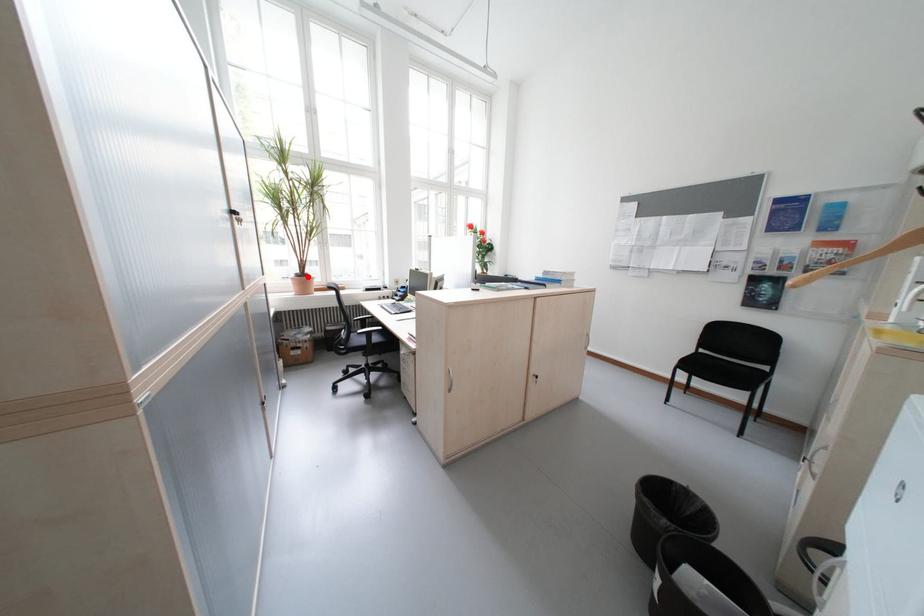
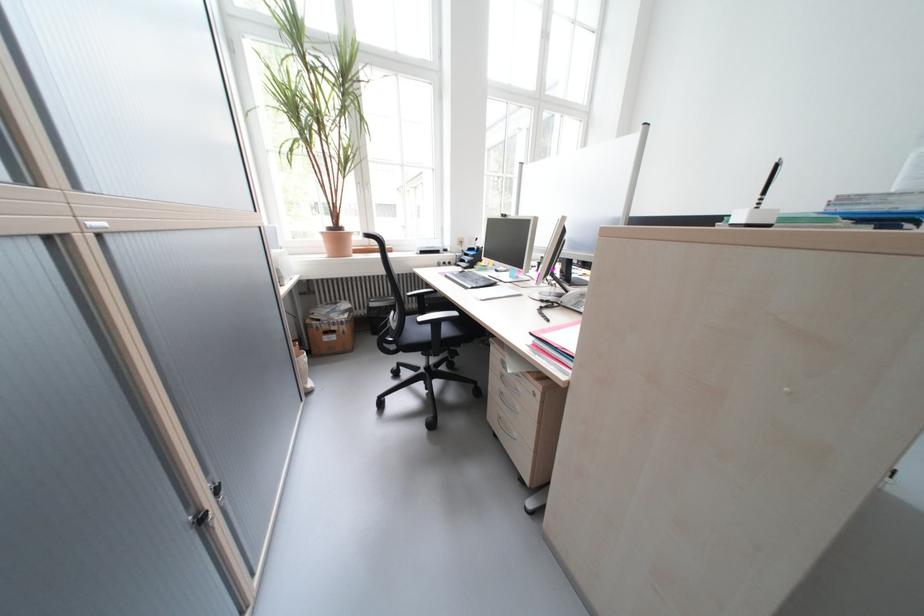
Locate, in the second image, the point that corresponds to the highlighted location in the first image.

(339, 231)